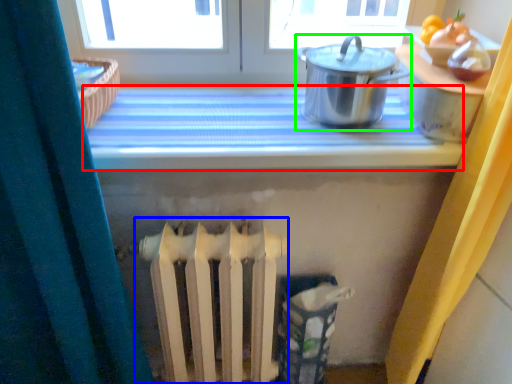
Question: Based on their relative distances, which object is farther from counter top (highlighted by a red box)? Choose from radiator (highlighted by a blue box) and kitchen appliance (highlighted by a green box).

Choices:
 (A) radiator
 (B) kitchen appliance

Answer: (A)